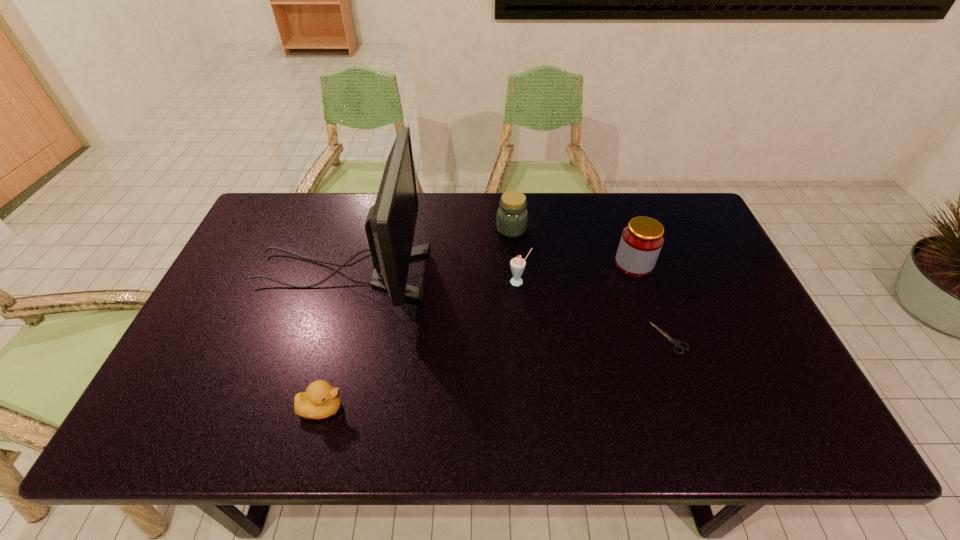
Where is `the tallest object`? This screenshot has width=960, height=540. the tallest object is located at coordinates (390, 225).

In order to click on the nearer jar in this screenshot , I will do `click(642, 239)`.

At what (x,y) coordinates should I click in order to perform the action: click on the farther jar. Please return your answer as a coordinate pair (x, y). Looking at the image, I should click on (512, 216).

The height and width of the screenshot is (540, 960). In order to click on the left jar in this screenshot , I will do `click(512, 216)`.

I want to click on milkshake, so click(x=517, y=264).

You are a GUI agent. You are given a task and a screenshot of the screen. Output one action in this format:
    pyautogui.click(x=<x>, y=<y>)
    Task: Click on the second shortest object
    This screenshot has width=960, height=540.
    Given the screenshot: What is the action you would take?
    (x=320, y=400)

The height and width of the screenshot is (540, 960). Find the location of `duckling`. duckling is located at coordinates (320, 400).

Identify the location of shears. (x=676, y=344).

Image resolution: width=960 pixels, height=540 pixels. In order to click on free space located 0.060m on the screen side of the computer monitor in this screenshot , I will do `click(446, 273)`.

Identify the location of vacant area situated on the front of the nearer jar. Image resolution: width=960 pixels, height=540 pixels. (646, 298).